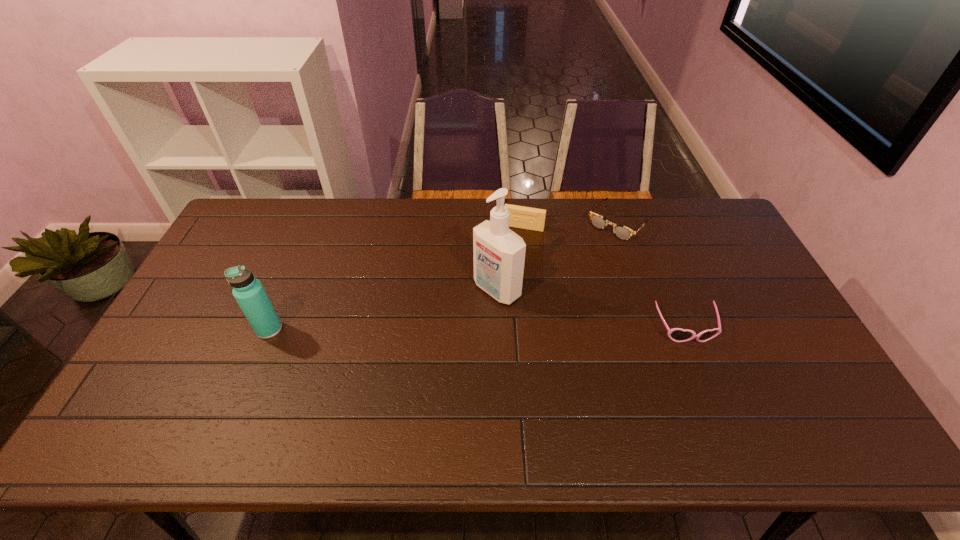
The image size is (960, 540). In order to click on vacant area between the leftmost object and the sunglasses in this screenshot , I will do `click(477, 329)`.

At what (x,y) coordinates should I click in order to perform the action: click on vacant point located between the sunglasses and the thermos bottle. Please return your answer as a coordinate pair (x, y). This screenshot has width=960, height=540. Looking at the image, I should click on (477, 329).

Locate an element on the screen. This screenshot has width=960, height=540. vacant area that lies between the sunglasses and the thermos bottle is located at coordinates (477, 329).

The height and width of the screenshot is (540, 960). Identify the location of unoccupied area between the thermos bottle and the spectacles. (444, 276).

Point out which object is positioned as the fourth nearest to the third nearest object. Please provide its 2D coordinates. Your answer should be formatted as a tuple, i.e. [(x, y)], where the tuple contains the x and y coordinates of a point satisfying the conditions above.

[(248, 291)]

At what (x,y) coordinates should I click in order to perform the action: click on object that is the third closest to the tallest object. Please return your answer as a coordinate pair (x, y). The image size is (960, 540). Looking at the image, I should click on (676, 334).

What are the coordinates of `vacant region that satisfies the following two spatial constraints: 1. on the back side of the videotape; 2. on the right side of the tallest object` in the screenshot? It's located at (494, 227).